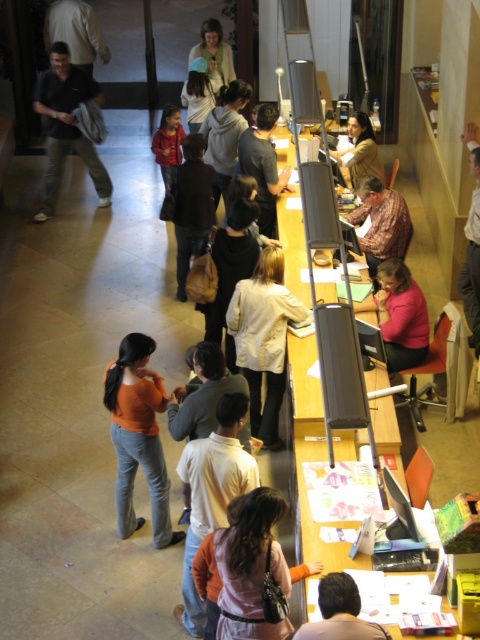
In the scene shown: Does white matte jacket at center appear on the right side of light brown shirt at center?

Correct, you'll find white matte jacket at center to the right of light brown shirt at center.

Is white matte jacket at center in front of light brown shirt at center?

No.

Who is more forward, (253,310) or (187,573)?

Point (187,573) is more forward.

Where is `white matte jacket at center`? The image size is (480, 640). white matte jacket at center is located at coordinates (264, 339).

Looking at this image, who is shorter, white matte jacket at center or matte beige sweater at center?

matte beige sweater at center

Is point (277, 387) in front of point (355, 186)?

That is True.

Which is behind, point (244, 289) or point (372, 150)?

The point (372, 150) is behind.

You are a GUI agent. You are given a task and a screenshot of the screen. Output one action in this format:
    pyautogui.click(x=<x>, y=<y>)
    Task: Click on the white matte jacket at center
    
    Given the screenshot: What is the action you would take?
    pyautogui.click(x=264, y=339)

Which is in front, point (302, 346) or point (469, 266)?

Point (302, 346)

Between point (308, 404) and point (460, 282), which one is positioned in front?

Point (308, 404)

Locate an element on the screen. The width and height of the screenshot is (480, 640). wooden desk at center is located at coordinates (290, 220).